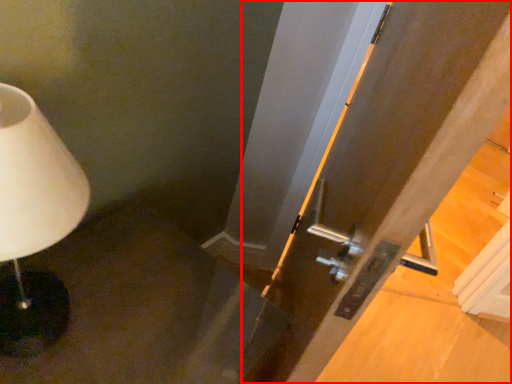
Question: From the image's perspective, what is the correct spatial positioning of door (annotated by the red box) in reference to lamp?

Choices:
 (A) above
 (B) below

Answer: (B)